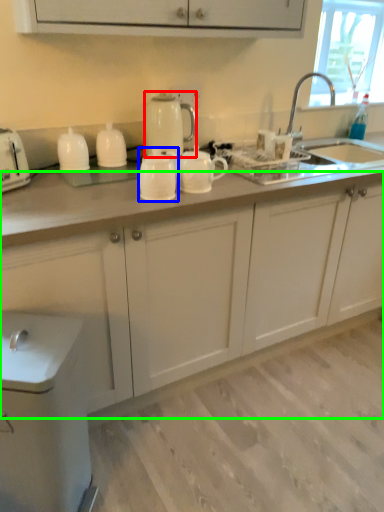
Question: Considering the real-world distances, which object is farthest from kitchen appliance (highlighted by a red box)? tableware (highlighted by a blue box) or cabinetry (highlighted by a green box)?

Choices:
 (A) tableware
 (B) cabinetry

Answer: (B)